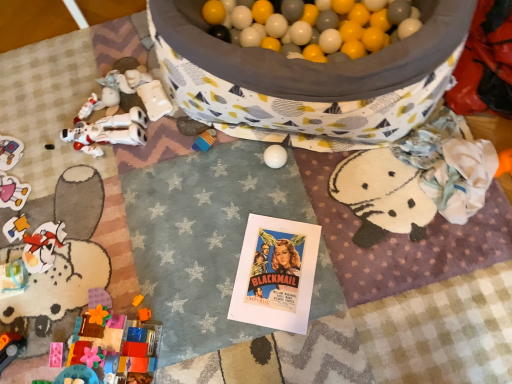
The height and width of the screenshot is (384, 512). Identify the location of vacant space that is in between plastic toy car at lower left, the 1th toy positioned from the back, and white matte robot at left, the fourth toy positioned from the bottom. (44, 142).